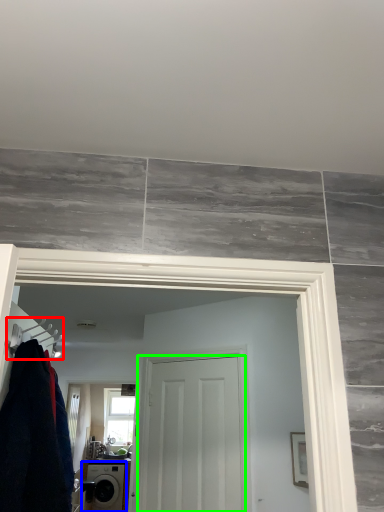
Question: Based on their relative distances, which object is farther from hanger (highlighted by a red box)? Choose from washing machine (highlighted by a blue box) and door (highlighted by a green box).

Choices:
 (A) washing machine
 (B) door

Answer: (A)